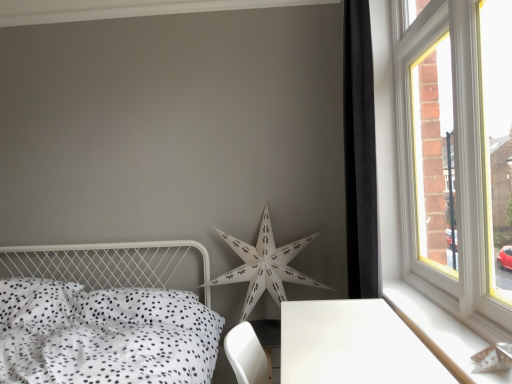
Question: Is white wood at right positioned beyond the bounds of white paper star at center?

Choices:
 (A) no
 (B) yes

Answer: (B)

Question: Is white wood at right bigger than white paper star at center?

Choices:
 (A) yes
 (B) no

Answer: (B)

Question: From the image's perspective, is white wood at right over white paper star at center?

Choices:
 (A) yes
 (B) no

Answer: (B)

Question: Is white wood at right positioned before white paper star at center?

Choices:
 (A) yes
 (B) no

Answer: (A)

Question: From the image's perspective, is white wood at right under white paper star at center?

Choices:
 (A) yes
 (B) no

Answer: (A)

Question: Is white wood at right behind white paper star at center?

Choices:
 (A) yes
 (B) no

Answer: (B)

Question: Is white dotted fabric bed at lower left facing towards white wood at right?

Choices:
 (A) no
 (B) yes

Answer: (A)

Question: From the image's perspective, is white dotted fabric bed at lower left on top of white wood at right?

Choices:
 (A) no
 (B) yes

Answer: (A)

Question: Is white dotted fabric bed at lower left thinner than white wood at right?

Choices:
 (A) no
 (B) yes

Answer: (A)

Question: Is white dotted fabric bed at lower left in front of white wood at right?

Choices:
 (A) yes
 (B) no

Answer: (A)

Question: Can you confirm if white dotted fabric bed at lower left is smaller than white wood at right?

Choices:
 (A) yes
 (B) no

Answer: (B)

Question: From a real-world perspective, is white dotted fabric bed at lower left positioned over white wood at right based on gravity?

Choices:
 (A) no
 (B) yes

Answer: (A)

Question: Could you tell me if white paper star at center is turned towards black velvet curtain at right?

Choices:
 (A) yes
 (B) no

Answer: (B)